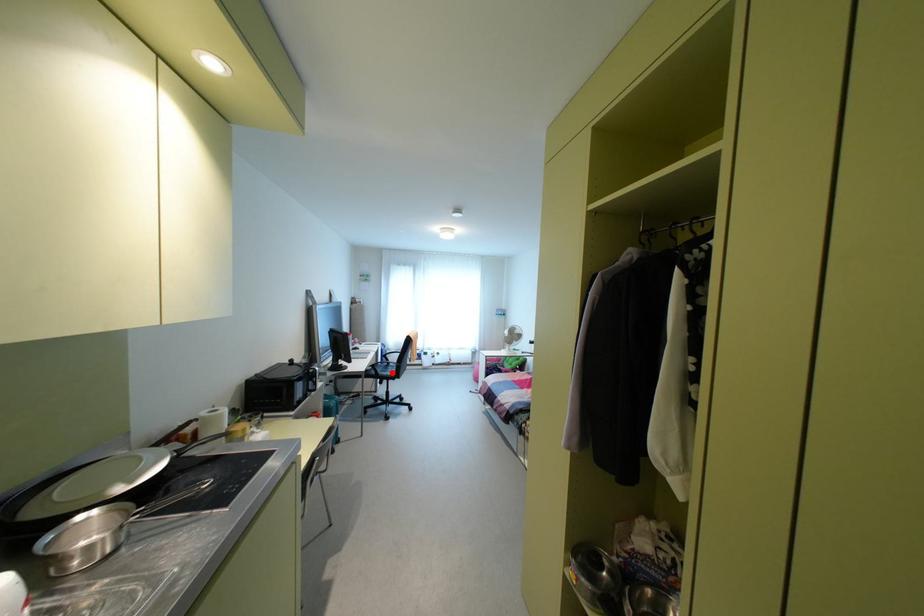
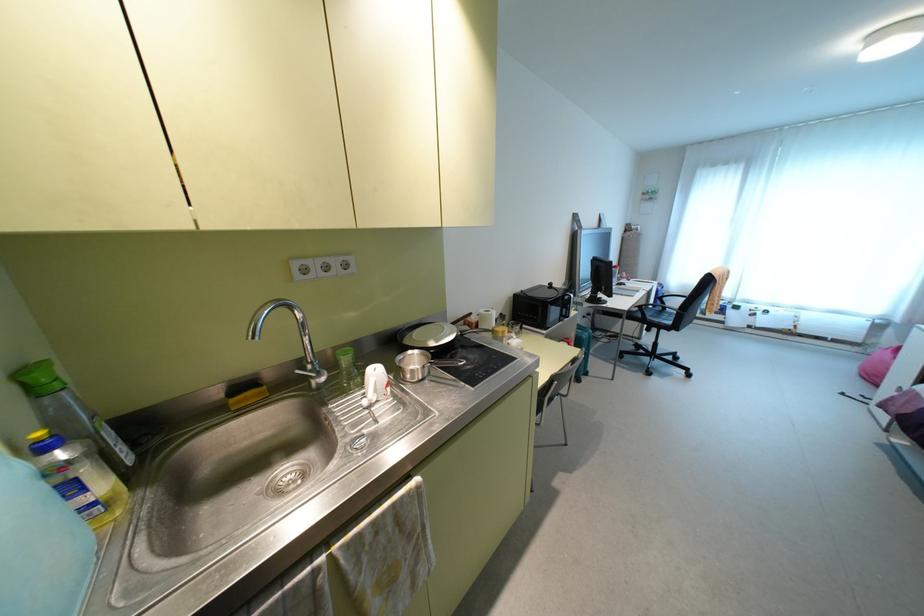
The point at the highlighted location is marked in the first image. Where is the corresponding point in the second image?

(667, 322)